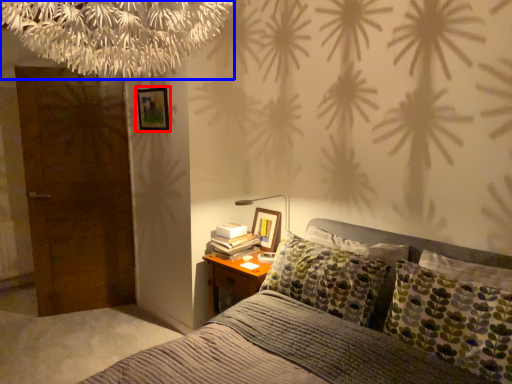
Question: Which object appears closest to the camera in this image, picture frame (highlighted by a red box) or tree (highlighted by a blue box)?

Choices:
 (A) picture frame
 (B) tree

Answer: (B)